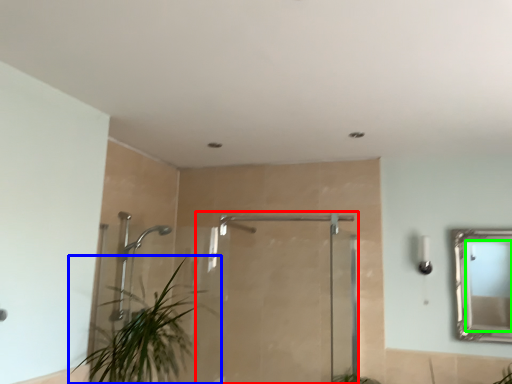
Question: Which object is the farthest from screen door (highlighted by a red box)? Choose among these: houseplant (highlighted by a blue box) or mirror (highlighted by a green box).

Choices:
 (A) houseplant
 (B) mirror

Answer: (B)